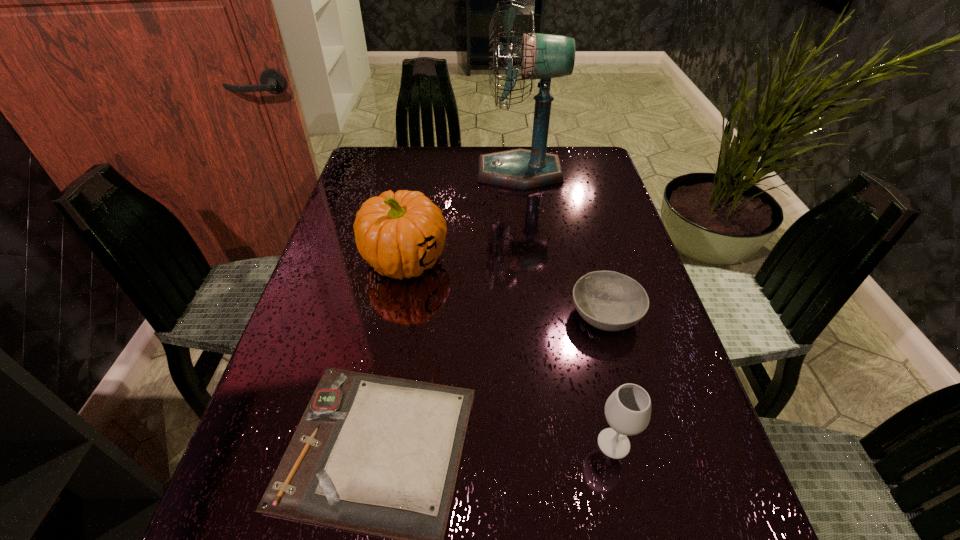
Locate an element on the screen. The height and width of the screenshot is (540, 960). blank area in the image that satisfies the following two spatial constraints: 1. in front of the farthest object where the wind blows; 2. on the surface of the fourth shortest object is located at coordinates (530, 260).

Where is `vacant point that satisfies the following two spatial constraints: 1. in front of the fourth tallest object where the wind blows; 2. on the left side of the fan`? The height and width of the screenshot is (540, 960). vacant point that satisfies the following two spatial constraints: 1. in front of the fourth tallest object where the wind blows; 2. on the left side of the fan is located at coordinates (537, 315).

Locate an element on the screen. free spot that satisfies the following two spatial constraints: 1. in front of the farthest object where the wind blows; 2. on the left side of the third tallest object is located at coordinates (553, 443).